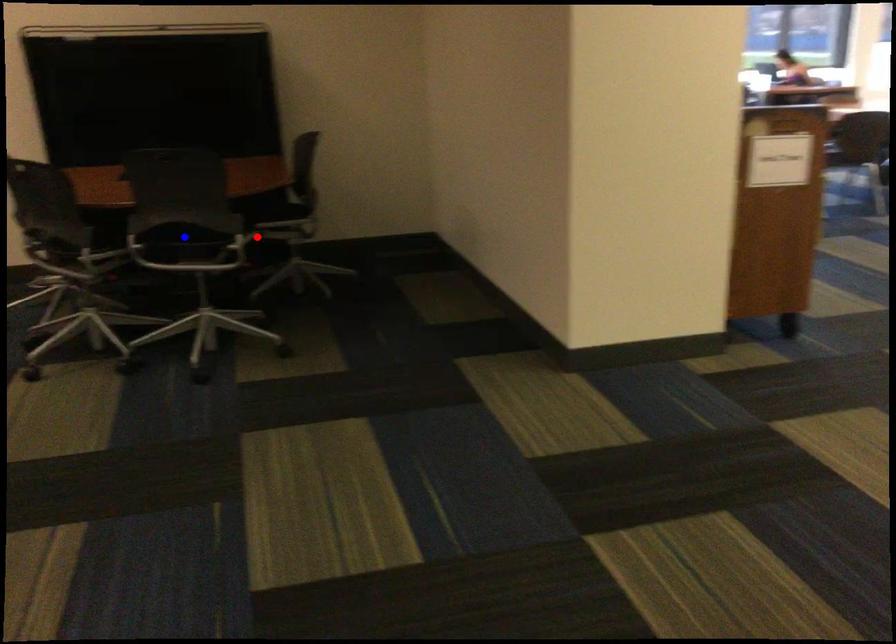
Question: Two points are marked on the image. Which point is closer to the camera?

Choices:
 (A) Blue point is closer.
 (B) Red point is closer.

Answer: (A)